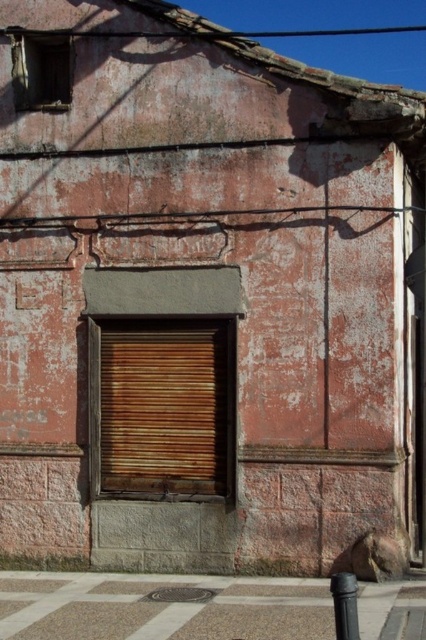
Does rusty wood shutter at center have a lesser width compared to black matte pole at lower right?

Incorrect, rusty wood shutter at center's width is not less than black matte pole at lower right's.

From the picture: Is the position of rusty wood shutter at center less distant than that of black matte pole at lower right?

No, it is behind black matte pole at lower right.

Is point (229, 465) positioned after point (345, 612)?

Yes.

The height and width of the screenshot is (640, 426). Find the location of `rusty wood shutter at center`. rusty wood shutter at center is located at coordinates (166, 406).